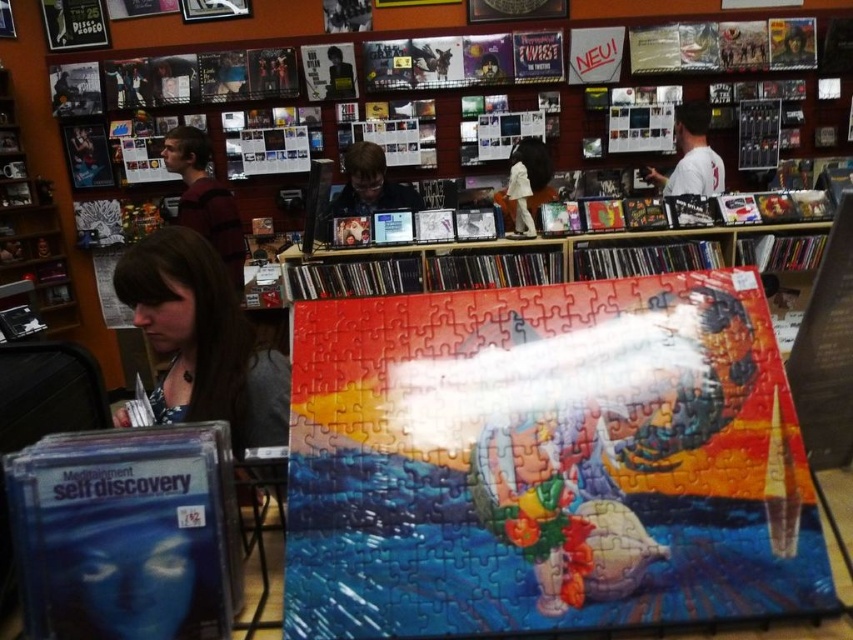
You are trying to decide which shirt to wear for a casual day out. You see the matte black shirt at center and the white cotton shirt at upper right in your closet. Which shirt is positioned to the left of the other?

The matte black shirt at center is positioned to the left of the white cotton shirt at upper right.

You are a customer in the record store and want to place a new vinyl record on the table where the matte black shirt at center is located. However, the wooden bookshelf at upper left might block your view. Can you see the table clearly from where you are standing?

The wooden bookshelf at upper left is bigger than the matte black shirt at center, so it might block your view of the table where the matte black shirt at center is located. You may need to move around the bookshelf to see the table clearly.